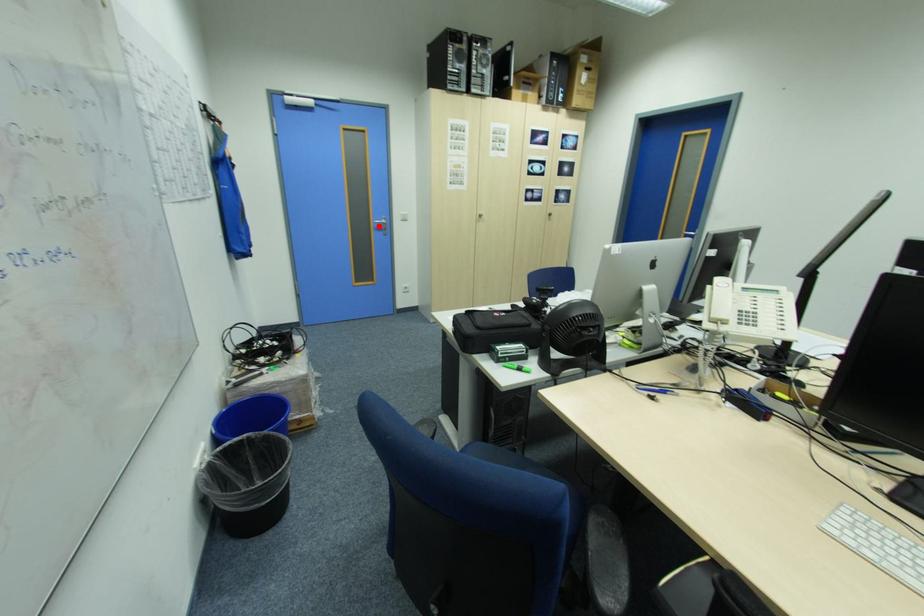
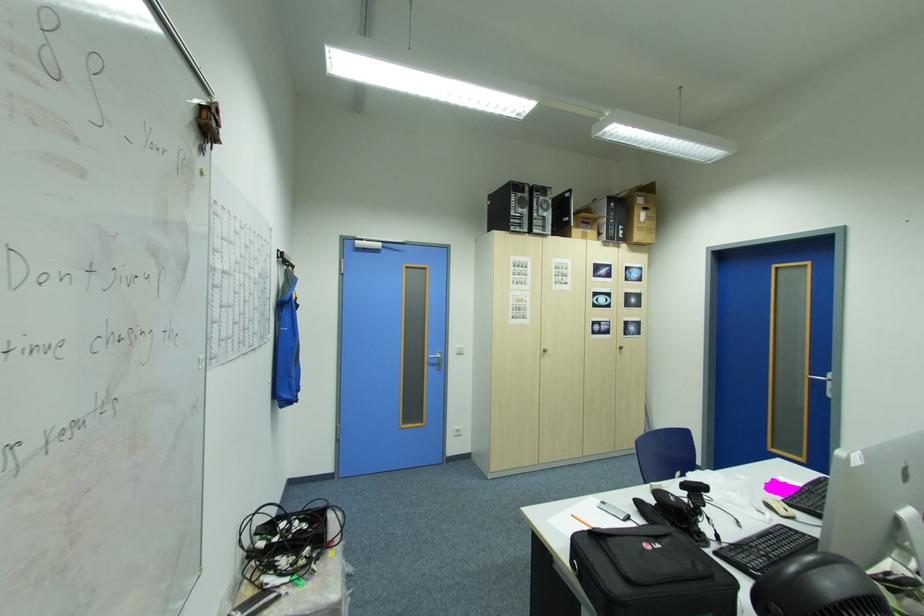
Question: I am providing you with two images of the same scene from different viewpoints. In image1, a red point is highlighted. Considering the same 3D point in image2, which of the following is correct?

Choices:
 (A) It is closer
 (B) It is farther

Answer: (B)